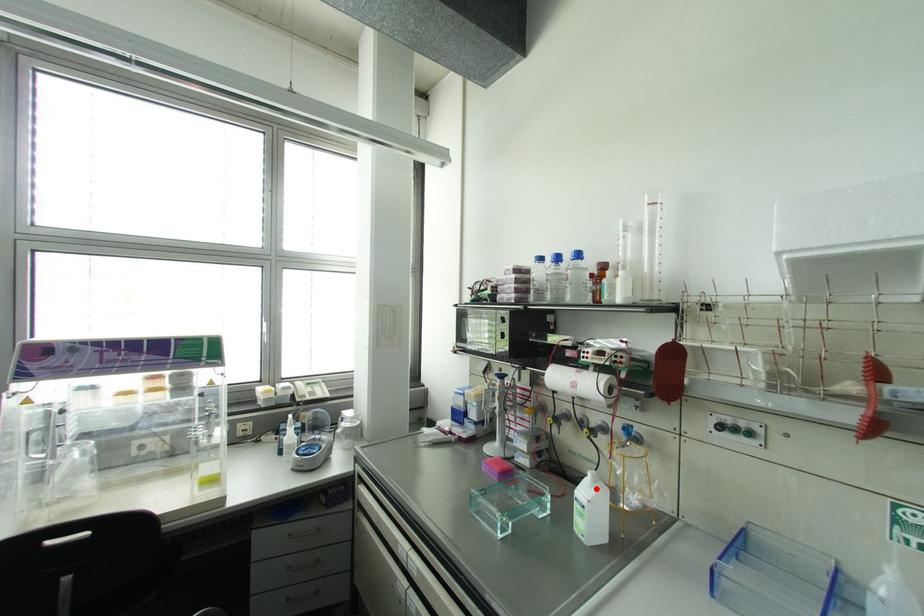
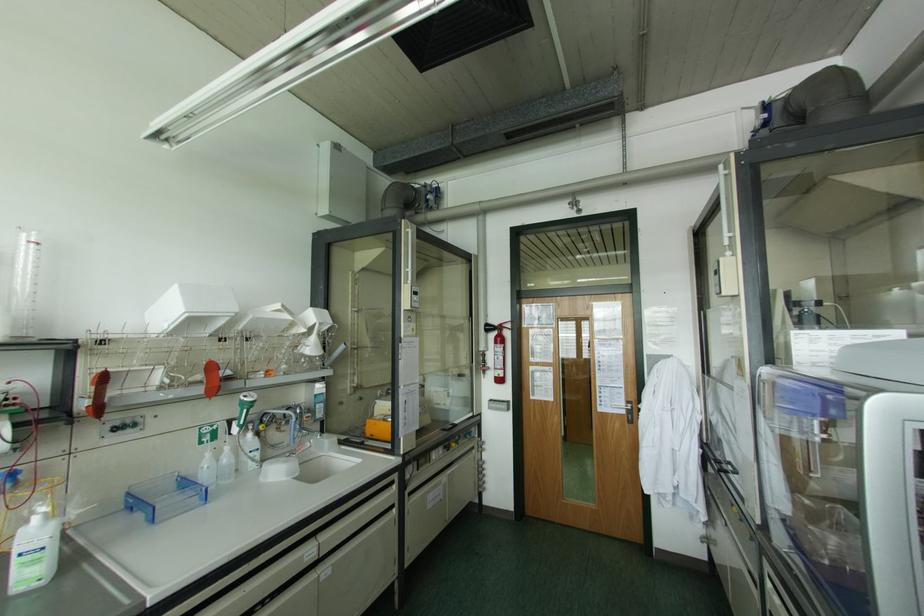
Locate, in the second image, the point that corresponds to the highlighted location in the first image.

(53, 523)